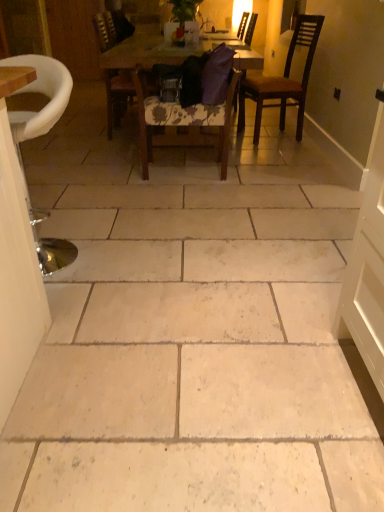
Question: Should I look upward or downward to see wooden table at center?

Choices:
 (A) up
 (B) down

Answer: (A)

Question: Can you see dark brown wooden chair at upper right, the third chair when ordered from front to back, touching purple fabric chair at center, which appears as the 5th chair when viewed from the front?

Choices:
 (A) no
 (B) yes

Answer: (A)

Question: Considering the relative sizes of dark brown wooden chair at upper right, the third chair when ordered from front to back, and purple fabric chair at center, which appears as the 5th chair when viewed from the front, in the image provided, is dark brown wooden chair at upper right, the third chair when ordered from front to back, shorter than purple fabric chair at center, which appears as the 5th chair when viewed from the front,?

Choices:
 (A) no
 (B) yes

Answer: (B)

Question: Can you confirm if dark brown wooden chair at upper right, the third chair when ordered from front to back, is bigger than purple fabric chair at center, placed as the first chair when sorted from back to front?

Choices:
 (A) no
 (B) yes

Answer: (A)

Question: Is dark brown wooden chair at upper right, the third chair when ordered from front to back, turned away from purple fabric chair at center, which appears as the 5th chair when viewed from the front?

Choices:
 (A) no
 (B) yes

Answer: (A)

Question: Can you confirm if dark brown wooden chair at upper right, the 3th chair viewed from the back, is positioned to the right of purple fabric chair at center, placed as the first chair when sorted from back to front?

Choices:
 (A) no
 (B) yes

Answer: (B)

Question: Considering the relative positions of dark brown wooden chair at upper right, the third chair when ordered from front to back, and purple fabric chair at center, placed as the first chair when sorted from back to front, in the image provided, is dark brown wooden chair at upper right, the third chair when ordered from front to back, to the left of purple fabric chair at center, placed as the first chair when sorted from back to front, from the viewer's perspective?

Choices:
 (A) no
 (B) yes

Answer: (A)

Question: Is metallic silver stool at left, which is the first chair from front to back, at the left side of wooden door at left?

Choices:
 (A) yes
 (B) no

Answer: (B)

Question: Is metallic silver stool at left, which is the 5th chair from back to front, outside wooden door at left?

Choices:
 (A) yes
 (B) no

Answer: (A)

Question: Considering the relative sizes of metallic silver stool at left, which is the first chair from front to back, and wooden door at left in the image provided, is metallic silver stool at left, which is the first chair from front to back, smaller than wooden door at left?

Choices:
 (A) yes
 (B) no

Answer: (B)

Question: From a real-world perspective, is metallic silver stool at left, which is the first chair from front to back, beneath wooden door at left?

Choices:
 (A) yes
 (B) no

Answer: (A)

Question: Considering the relative sizes of metallic silver stool at left, which is the 5th chair from back to front, and wooden door at left in the image provided, is metallic silver stool at left, which is the 5th chair from back to front, bigger than wooden door at left?

Choices:
 (A) yes
 (B) no

Answer: (A)

Question: From the image's perspective, is metallic silver stool at left, which is the first chair from front to back, located beneath wooden door at left?

Choices:
 (A) yes
 (B) no

Answer: (A)

Question: From the image's perspective, is floral fabric chair at center, which is counted as the fourth chair, starting from the back, over wooden door at left?

Choices:
 (A) yes
 (B) no

Answer: (B)